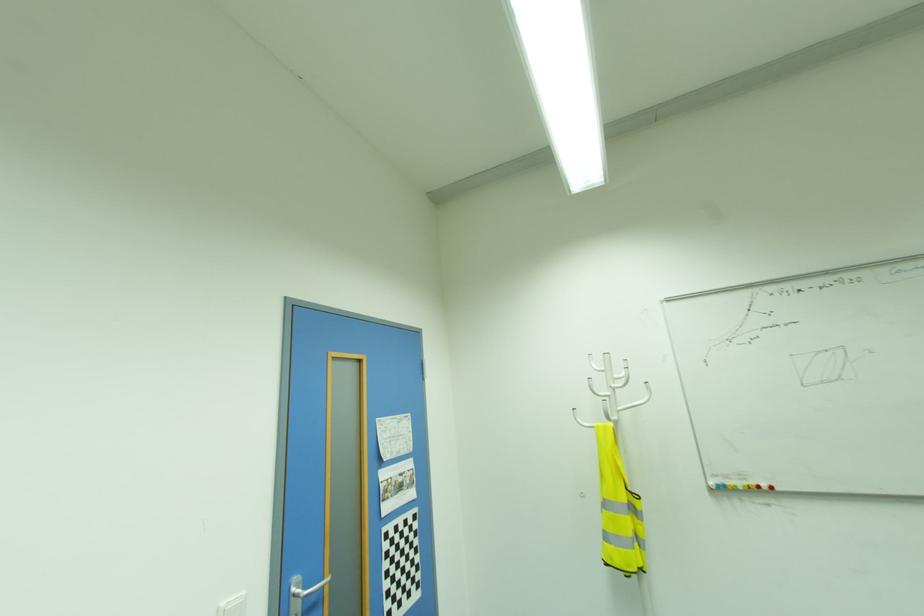
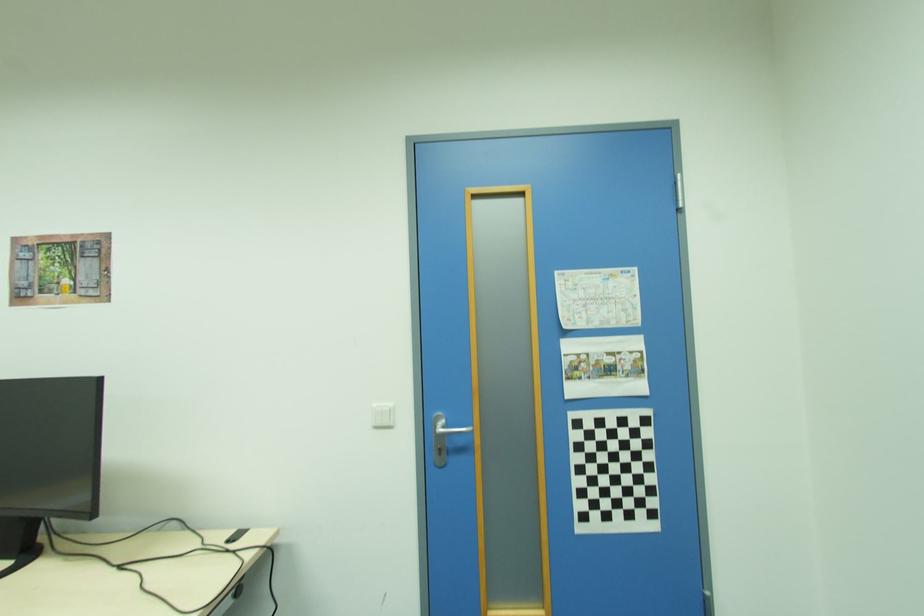
The point at (397,456) is marked in the first image. Where is the corresponding point in the second image?

(599, 325)